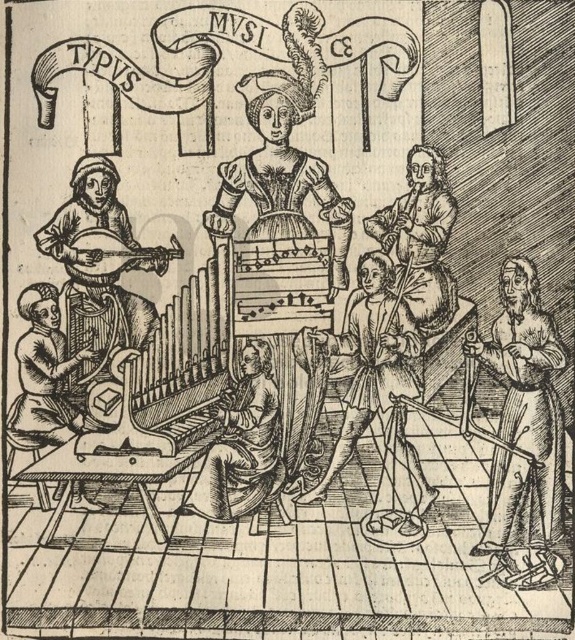
Question: Considering the relative positions of smooth white robe at right and wooden lute at left in the image provided, where is smooth white robe at right located with respect to wooden lute at left?

Choices:
 (A) above
 (B) below

Answer: (B)

Question: Among these objects, which one is nearest to the camera?

Choices:
 (A) wooden harp at lower left
 (B) matte black organ at center
 (C) smooth wood flute at center

Answer: (A)

Question: Does smooth white robe at right appear on the right side of smooth wood person at center?

Choices:
 (A) no
 (B) yes

Answer: (B)

Question: Does matte black organ at center appear on the left side of smooth wood person at center?

Choices:
 (A) yes
 (B) no

Answer: (B)

Question: Based on their relative distances, which object is farther from the smooth wood person at center?

Choices:
 (A) wooden harp at lower left
 (B) smooth wood flute at center
 (C) smooth white robe at right

Answer: (C)

Question: Considering the real-world distances, which object is closest to the smooth wood person at center?

Choices:
 (A) smooth white robe at right
 (B) wooden harp at lower left
 (C) smooth wood flute at center
 (D) wooden lute at left

Answer: (C)